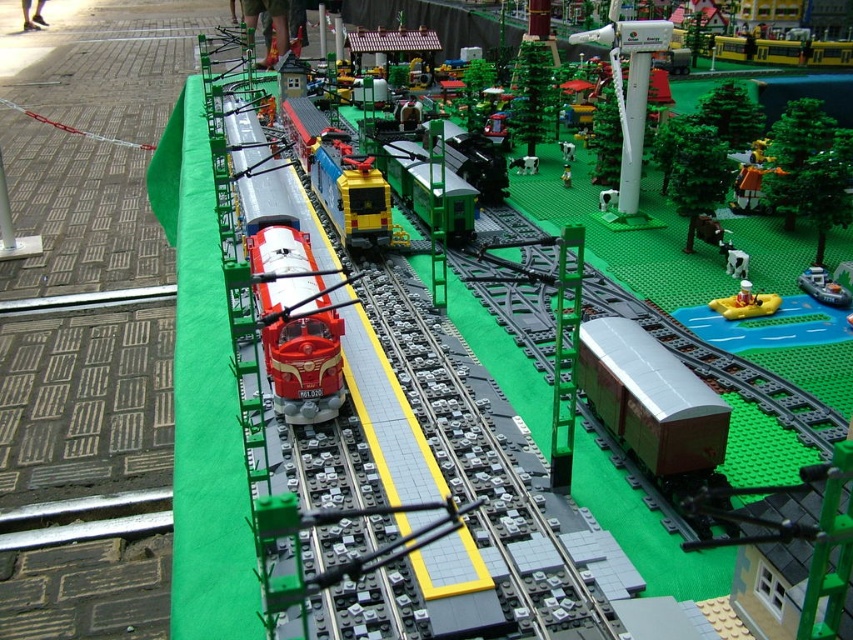
Between shiny red train at center and yellow rubber boat at lower right, which one appears on the right side from the viewer's perspective?

yellow rubber boat at lower right

Is shiny red train at center bigger than yellow rubber boat at lower right?

Yes.

The image size is (853, 640). What do you see at coordinates (283, 280) in the screenshot? I see `shiny red train at center` at bounding box center [283, 280].

The image size is (853, 640). Find the location of `shiny red train at center`. shiny red train at center is located at coordinates (283, 280).

Does brown matte cargo train at center have a greater width compared to white plastic wind turbine at upper center?

Yes.

Can you confirm if brown matte cargo train at center is positioned to the left of white plastic wind turbine at upper center?

Correct, you'll find brown matte cargo train at center to the left of white plastic wind turbine at upper center.

At what (x,y) coordinates should I click in order to perform the action: click on brown matte cargo train at center. Please return your answer as a coordinate pair (x, y). Looking at the image, I should click on (650, 397).

Does point (605, 420) lie in front of point (370, 221)?

Yes, point (605, 420) is in front of point (370, 221).

Does brown matte cargo train at center appear over shiny yellow train at center?

Actually, brown matte cargo train at center is below shiny yellow train at center.

The width and height of the screenshot is (853, 640). In order to click on brown matte cargo train at center in this screenshot , I will do `click(650, 397)`.

Locate an element on the screen. The height and width of the screenshot is (640, 853). brown matte cargo train at center is located at coordinates (650, 397).